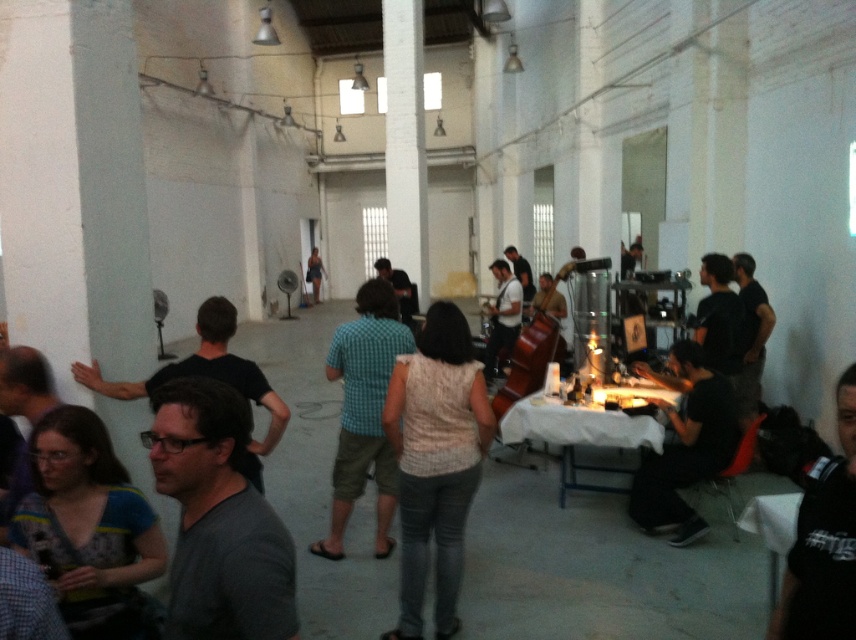
Who is lower down, knitted beige sweater at center or black cotton t-shirt at lower right?

knitted beige sweater at center is below.

Is knitted beige sweater at center bigger than black cotton t-shirt at lower right?

Yes.

Is point (437, 490) positioned behind point (812, 518)?

Yes, point (437, 490) is farther from viewer.

At what (x,y) coordinates should I click in order to perform the action: click on knitted beige sweater at center. Please return your answer as a coordinate pair (x, y). The image size is (856, 640). Looking at the image, I should click on click(x=435, y=461).

Which is behind, point (823, 541) or point (690, 524)?

The point (690, 524) is more distant.

Consider the image. Which is more to the left, black cotton t-shirt at lower right or black matte shirt at lower right?

black cotton t-shirt at lower right

Which is behind, point (843, 376) or point (676, 429)?

Point (676, 429)

This screenshot has width=856, height=640. In order to click on black cotton t-shirt at lower right in this screenshot , I will do `click(823, 541)`.

Is checkered fabric shirt at center positioned at the back of black matte shirt at lower right?

No, checkered fabric shirt at center is closer to the viewer.

Between point (375, 449) and point (714, 440), which one is positioned in front?

Point (375, 449) is in front.

Locate an element on the screen. The height and width of the screenshot is (640, 856). checkered fabric shirt at center is located at coordinates (364, 412).